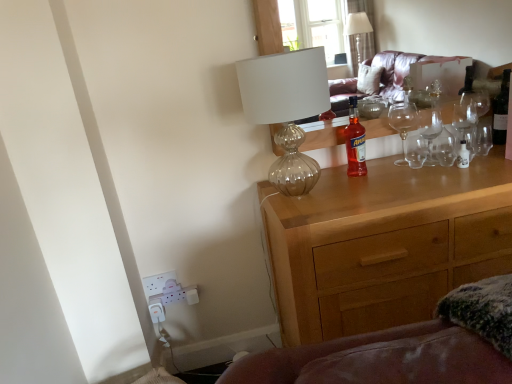
Question: In the image, is wooden chest of drawers at center on the left side or the right side of translucent glass lamp at upper center?

Choices:
 (A) left
 (B) right

Answer: (B)

Question: From their relative heights in the image, would you say wooden chest of drawers at center is taller or shorter than translucent glass lamp at upper center?

Choices:
 (A) short
 (B) tall

Answer: (B)

Question: Considering the real-world distances, which object is closest to the translucent glass lamp at upper center?

Choices:
 (A) dark glass wine bottle at upper right
 (B) translucent glass bottle at center
 (C) wooden chest of drawers at center

Answer: (B)

Question: Estimate the real-world distances between objects in this image. Which object is farther from the translucent glass bottle at center?

Choices:
 (A) wooden chest of drawers at center
 (B) dark glass wine bottle at upper right
 (C) translucent glass lamp at upper center

Answer: (B)